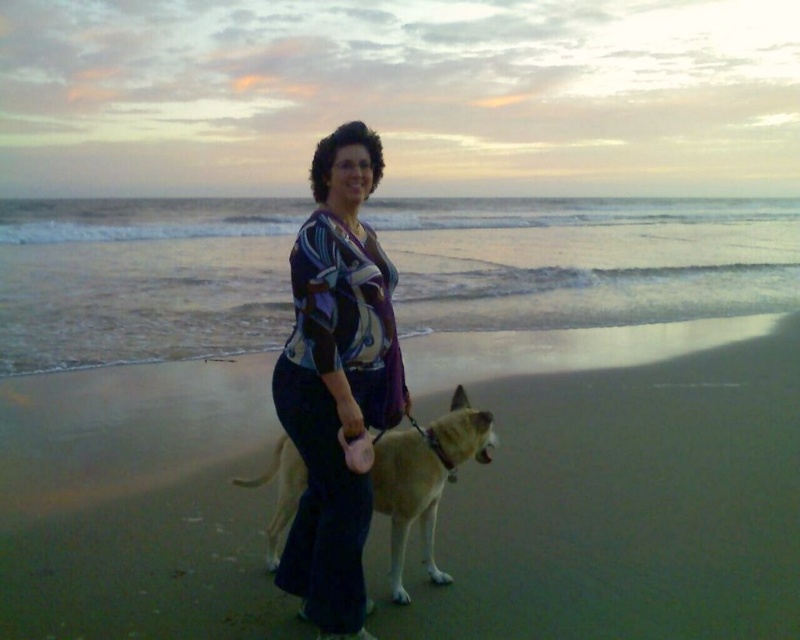
Question: Which object is closer to the camera taking this photo?

Choices:
 (A) printed silk blouse at center
 (B) fuzzy tan dog at center

Answer: (A)

Question: Estimate the real-world distances between objects in this image. Which object is closer to the fuzzy tan dog at center?

Choices:
 (A) printed silk blouse at center
 (B) sandy brown sand at center

Answer: (A)

Question: Which point is farther from the camera taking this photo?

Choices:
 (A) 401,509
 (B) 300,449

Answer: (A)

Question: Does printed silk blouse at center have a smaller size compared to fuzzy tan dog at center?

Choices:
 (A) yes
 (B) no

Answer: (B)

Question: Is printed silk blouse at center in front of fuzzy tan dog at center?

Choices:
 (A) no
 (B) yes

Answer: (B)

Question: Is printed silk blouse at center above fuzzy tan dog at center?

Choices:
 (A) no
 (B) yes

Answer: (B)